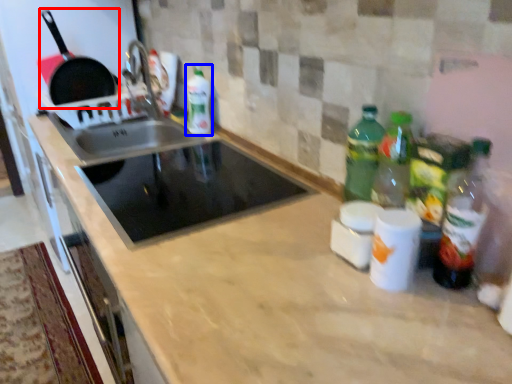
Question: Among these objects, which one is nearest to the camera, frying pan (highlighted by a red box) or bottle (highlighted by a blue box)?

Choices:
 (A) frying pan
 (B) bottle

Answer: (B)